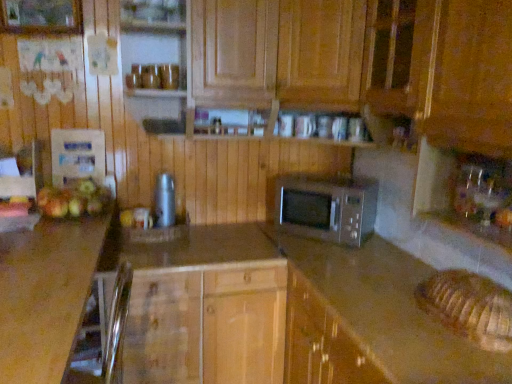
Question: Considering the positions of brown laminate counter at center and silver metallic microwave at center in the image, is brown laminate counter at center wider or thinner than silver metallic microwave at center?

Choices:
 (A) thin
 (B) wide

Answer: (B)

Question: Relative to silver metallic microwave at center, is brown laminate counter at center in front or behind?

Choices:
 (A) behind
 (B) front

Answer: (B)

Question: Estimate the real-world distances between objects in this image. Which object is farther from the silver metallic microwave at center?

Choices:
 (A) wooden cabinet at center
 (B) shiny golden apples at left, which is counted as the first apple, starting from the front
 (C) brushed metal thermos at center
 (D) transparent glass sink at right
 (E) smooth granite countertop at center, which is counted as the second countertop, starting from the left

Answer: (B)

Question: Which object is positioned farthest from the brown laminate countertop at lower left, placed as the first countertop when sorted from left to right?

Choices:
 (A) wooden cabinet at center
 (B) transparent glass sink at right
 (C) green matte apple at left, placed as the second apple when sorted from top to bottom
 (D) brown laminate counter at center
 (E) shiny golden apples at left, arranged as the 1th apple when viewed from the top

Answer: (B)